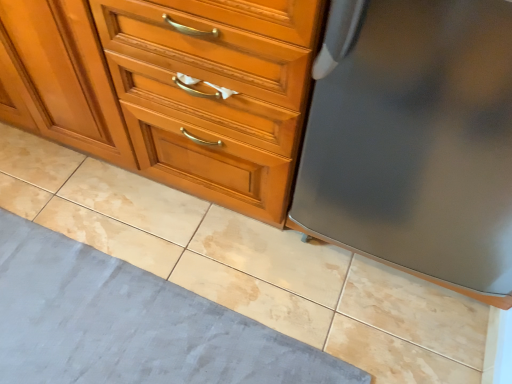
Question: Is satin gray refrigerator at right bigger than matte wood chest of drawers at center?

Choices:
 (A) no
 (B) yes

Answer: (A)

Question: From the image's perspective, does satin gray refrigerator at right appear lower than matte wood chest of drawers at center?

Choices:
 (A) yes
 (B) no

Answer: (A)

Question: Does satin gray refrigerator at right turn towards matte wood chest of drawers at center?

Choices:
 (A) no
 (B) yes

Answer: (A)

Question: Can you confirm if satin gray refrigerator at right is taller than matte wood chest of drawers at center?

Choices:
 (A) yes
 (B) no

Answer: (B)

Question: From a real-world perspective, is satin gray refrigerator at right on matte wood chest of drawers at center?

Choices:
 (A) no
 (B) yes

Answer: (A)

Question: Is matte wood chest of drawers at center in front of or behind satin gray refrigerator at right in the image?

Choices:
 (A) behind
 (B) front

Answer: (A)

Question: From a real-world perspective, relative to satin gray refrigerator at right, is matte wood chest of drawers at center vertically above or below?

Choices:
 (A) below
 (B) above

Answer: (B)

Question: From the image's perspective, relative to satin gray refrigerator at right, is matte wood chest of drawers at center above or below?

Choices:
 (A) above
 (B) below

Answer: (A)

Question: Considering the positions of matte wood chest of drawers at center and satin gray refrigerator at right in the image, is matte wood chest of drawers at center bigger or smaller than satin gray refrigerator at right?

Choices:
 (A) big
 (B) small

Answer: (A)

Question: From a real-world perspective, is gray fabric bath mat at lower left physically located above or below matte wood chest of drawers at center?

Choices:
 (A) below
 (B) above

Answer: (A)

Question: Is point (112, 367) closer or farther from the camera than point (75, 41)?

Choices:
 (A) closer
 (B) farther

Answer: (B)

Question: Considering the positions of gray fabric bath mat at lower left and matte wood chest of drawers at center in the image, is gray fabric bath mat at lower left wider or thinner than matte wood chest of drawers at center?

Choices:
 (A) wide
 (B) thin

Answer: (A)

Question: From the image's perspective, is gray fabric bath mat at lower left above or below matte wood chest of drawers at center?

Choices:
 (A) below
 (B) above

Answer: (A)

Question: From the image's perspective, is satin gray refrigerator at right above or below matte wood chest of drawers at center?

Choices:
 (A) above
 (B) below

Answer: (B)

Question: Is point (456, 115) closer or farther from the camera than point (145, 148)?

Choices:
 (A) closer
 (B) farther

Answer: (A)